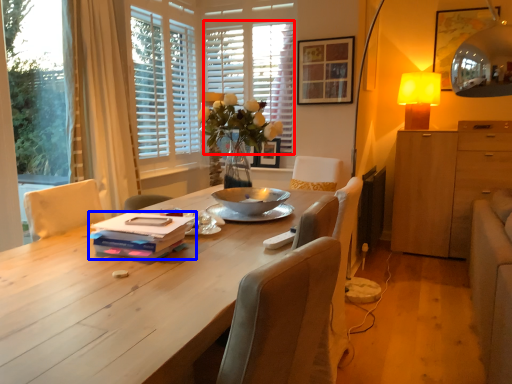
Question: Which point is further to the camera, blind (highlighted by a red box) or book (highlighted by a blue box)?

Choices:
 (A) blind
 (B) book

Answer: (A)